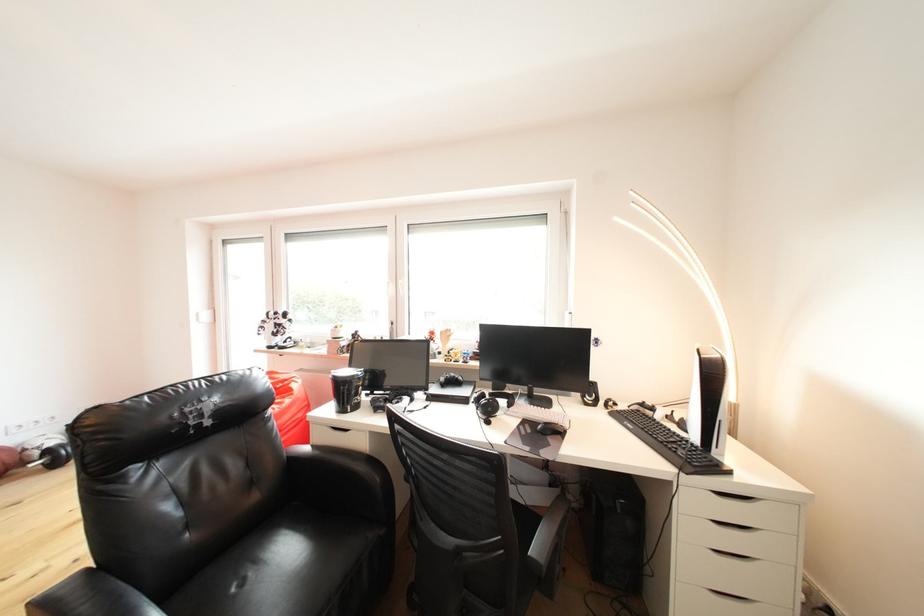
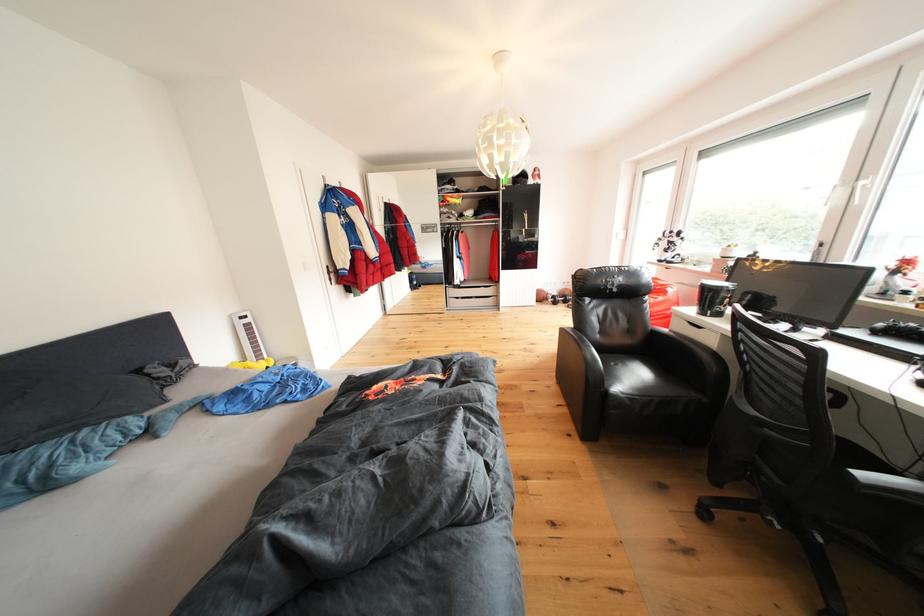
Find the pixel in the second image that matches (251,588) in the first image.

(625, 370)